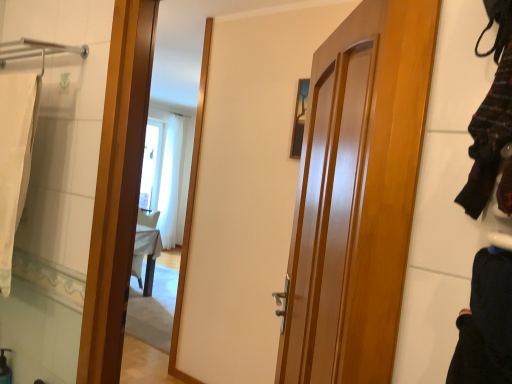
Question: Considering the relative sizes of glossy wood door at center and striped wool sweater at right, the first clothing positioned from the top, in the image provided, is glossy wood door at center wider than striped wool sweater at right, the first clothing positioned from the top,?

Choices:
 (A) yes
 (B) no

Answer: (A)

Question: Could striped wool sweater at right, the first clothing positioned from the top, be considered to be inside glossy wood door at center?

Choices:
 (A) no
 (B) yes

Answer: (A)

Question: Can you confirm if glossy wood door at center is thinner than striped wool sweater at right, the 2th clothing positioned from the bottom?

Choices:
 (A) yes
 (B) no

Answer: (B)

Question: Is glossy wood door at center oriented away from striped wool sweater at right, the 2th clothing positioned from the bottom?

Choices:
 (A) no
 (B) yes

Answer: (A)

Question: Are glossy wood door at center and striped wool sweater at right, the first clothing positioned from the top, located far from each other?

Choices:
 (A) no
 (B) yes

Answer: (A)

Question: Considering their positions, is glossy wood door at center located in front of or behind striped wool sweater at right, the first clothing positioned from the top?

Choices:
 (A) front
 (B) behind

Answer: (B)

Question: Considering the positions of glossy wood door at center and striped wool sweater at right, the 2th clothing positioned from the bottom, in the image, is glossy wood door at center wider or thinner than striped wool sweater at right, the 2th clothing positioned from the bottom,?

Choices:
 (A) thin
 (B) wide

Answer: (B)

Question: In terms of size, does glossy wood door at center appear bigger or smaller than striped wool sweater at right, the first clothing positioned from the top?

Choices:
 (A) small
 (B) big

Answer: (B)

Question: Does point (318, 196) appear closer or farther from the camera than point (477, 152)?

Choices:
 (A) closer
 (B) farther

Answer: (B)

Question: Is striped wool sweater at right, the first clothing positioned from the top, in front of or behind black cotton pants at lower right, arranged as the second clothing when viewed from the top, in the image?

Choices:
 (A) behind
 (B) front

Answer: (A)

Question: Considering the positions of striped wool sweater at right, the 2th clothing positioned from the bottom, and black cotton pants at lower right, the 1th clothing ordered from the bottom, in the image, is striped wool sweater at right, the 2th clothing positioned from the bottom, wider or thinner than black cotton pants at lower right, the 1th clothing ordered from the bottom,?

Choices:
 (A) thin
 (B) wide

Answer: (A)

Question: Considering the positions of point (472, 155) and point (507, 339), is point (472, 155) closer or farther from the camera than point (507, 339)?

Choices:
 (A) closer
 (B) farther

Answer: (B)

Question: Looking at the image, does striped wool sweater at right, the 2th clothing positioned from the bottom, seem bigger or smaller compared to black cotton pants at lower right, the 1th clothing ordered from the bottom?

Choices:
 (A) big
 (B) small

Answer: (B)

Question: From the image's perspective, is white fabric bath towel at left located above or below black cotton pants at lower right, the 1th clothing ordered from the bottom?

Choices:
 (A) above
 (B) below

Answer: (A)

Question: In terms of width, does white fabric bath towel at left look wider or thinner when compared to black cotton pants at lower right, the 1th clothing ordered from the bottom?

Choices:
 (A) thin
 (B) wide

Answer: (B)